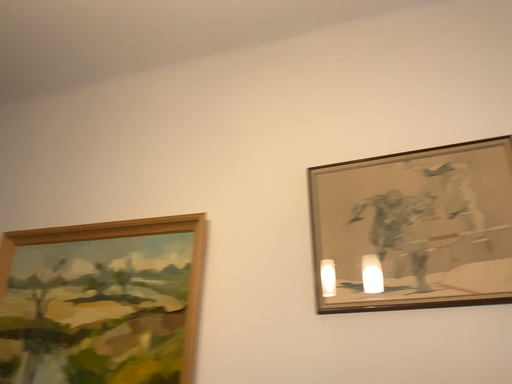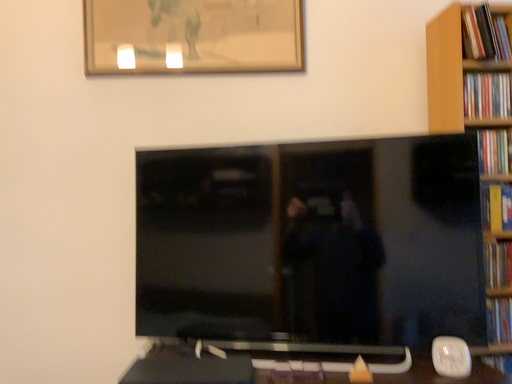
Question: Which way did the camera rotate in the video?

Choices:
 (A) rotated left
 (B) rotated right

Answer: (B)